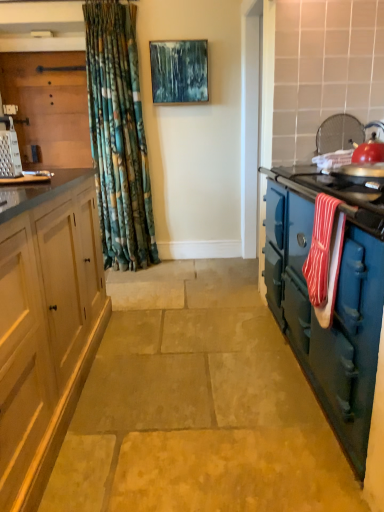
Question: From the image's perspective, is blue cast iron stove at right, the first cabinetry from the bottom, positioned above or below red striped towel at right?

Choices:
 (A) above
 (B) below

Answer: (B)

Question: In terms of size, does blue cast iron stove at right, the second cabinetry positioned from the top, appear bigger or smaller than red striped towel at right?

Choices:
 (A) big
 (B) small

Answer: (A)

Question: Estimate the real-world distances between objects in this image. Which object is closer to the metallic silver grater at left?

Choices:
 (A) red striped towel at right
 (B) brushed metal grater at left, placed as the 1th cabinetry when sorted from top to bottom
 (C) natural stone floor at center
 (D) blue cast iron stove at right, which is the 1th cabinetry in right-to-left order
 (E) textured canvas painting at upper center

Answer: (C)

Question: Which is nearer to the natural stone floor at center?

Choices:
 (A) brushed metal grater at left, placed as the 1th cabinetry when sorted from top to bottom
 (B) textured canvas painting at upper center
 (C) red striped towel at right
 (D) blue cast iron stove at right, which is the second cabinetry in back-to-front order
 (E) metallic silver grater at left

Answer: (D)